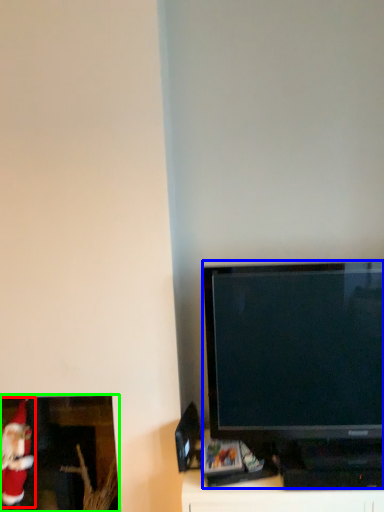
Question: Which object is positioned farthest from santa claus (highlighted by a red box)? Select from television (highlighted by a blue box) and picture frame (highlighted by a green box).

Choices:
 (A) television
 (B) picture frame

Answer: (A)